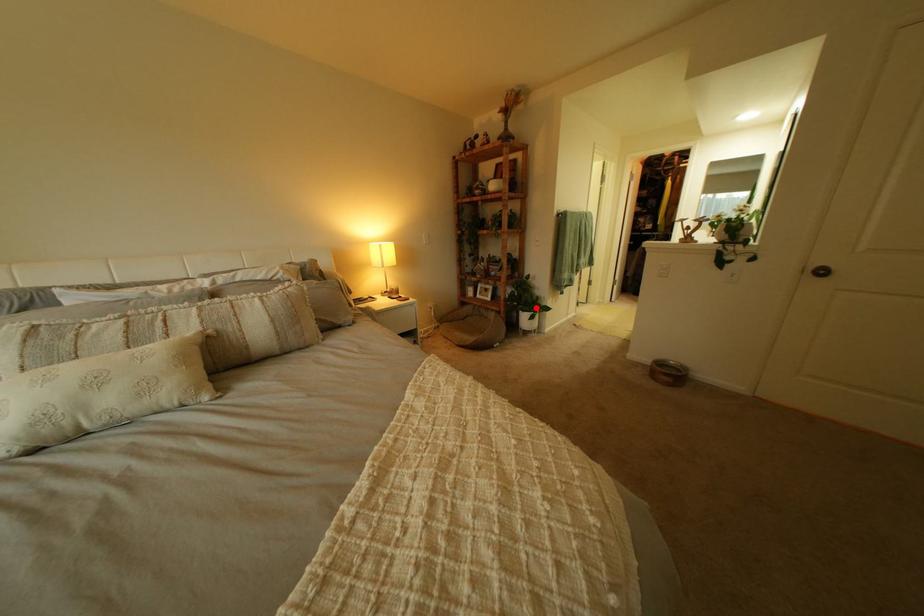
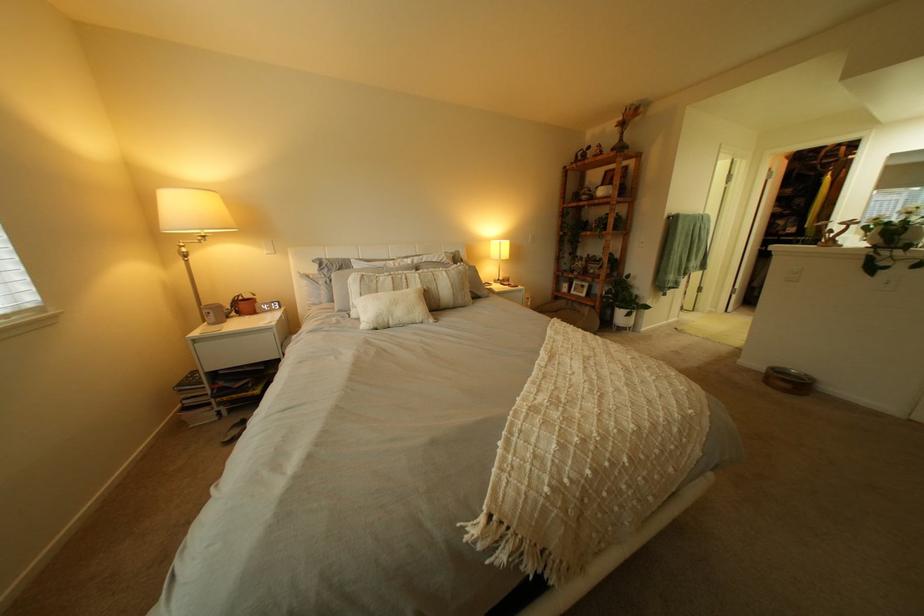
The point at the highlighted location is marked in the first image. Where is the corresponding point in the second image?

(633, 305)